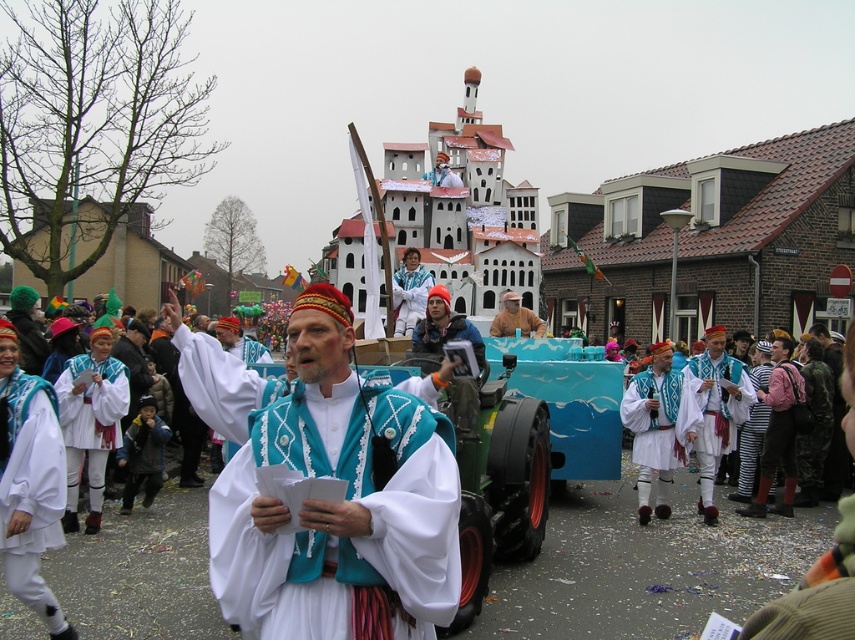
Question: Which object is closer to the camera taking this photo?

Choices:
 (A) white cotton pants at lower left
 (B) brown fabric hat at center
 (C) striped fabric pants at center
 (D) white satin robe at center

Answer: (D)

Question: Among these points, which one is farthest from the camera?

Choices:
 (A) (422, 298)
 (B) (333, 445)
 (C) (16, 436)
 (D) (740, 472)

Answer: (A)

Question: Does white satin robe at center appear over white fabric costume at center?

Choices:
 (A) yes
 (B) no

Answer: (B)

Question: Among these points, which one is nearest to the camera?

Choices:
 (A) (746, 470)
 (B) (416, 308)

Answer: (A)

Question: Considering the relative positions of white satin robe at center and white fabric costume at center in the image provided, where is white satin robe at center located with respect to white fabric costume at center?

Choices:
 (A) below
 (B) above

Answer: (A)

Question: Can you confirm if white satin robe at center is positioned to the right of white cotton pants at lower left?

Choices:
 (A) yes
 (B) no

Answer: (A)